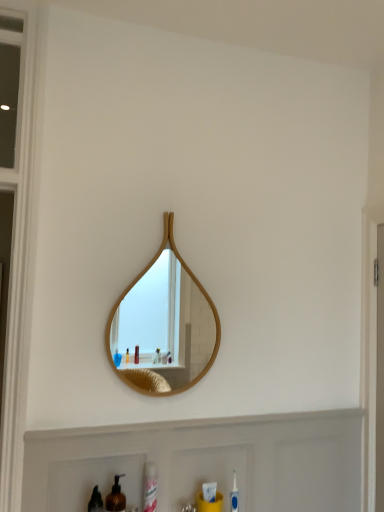
Locate an element on the screen. The image size is (384, 512). brown matte bottle at lower left is located at coordinates (116, 497).

From a real-world perspective, is brown matte bottle at lower left located higher than white matte cabinet at lower center?

No, from a real-world perspective, brown matte bottle at lower left is not on top of white matte cabinet at lower center.

Do you think brown matte bottle at lower left is within white matte cabinet at lower center, or outside of it?

brown matte bottle at lower left is not enclosed by white matte cabinet at lower center.

Considering the points (108, 509) and (191, 484), which point is behind, point (108, 509) or point (191, 484)?

Positioned behind is point (191, 484).

From the picture: From a real-world perspective, is brown matte bottle at lower left beneath white glossy spray can at lower center?

Indeed, from a real-world perspective, brown matte bottle at lower left is positioned beneath white glossy spray can at lower center.

Is brown matte bottle at lower left to the right of white glossy spray can at lower center from the viewer's perspective?

No.

The width and height of the screenshot is (384, 512). In order to click on mouthwash located underneath the white glossy spray can at lower center (from a real-world perspective) in this screenshot , I will do `click(116, 497)`.

Which is behind, brown matte bottle at lower left or white glossy spray can at lower center?

white glossy spray can at lower center is further away from the camera.

Which is closer, (314,426) or (121,372)?

Point (314,426) is positioned closer to the camera compared to point (121,372).

Does white matte cabinet at lower center appear on the right side of wooden mirror at center?

Yes.

Would you say white matte cabinet at lower center is outside wooden mirror at center?

Yes, white matte cabinet at lower center is outside of wooden mirror at center.

From a real-world perspective, between white glossy spray can at lower center and white matte cabinet at lower center, who is vertically lower?

From a 3D spatial view, white glossy spray can at lower center is below.

Is white matte cabinet at lower center inside white glossy spray can at lower center?

No, white matte cabinet at lower center is not a part of white glossy spray can at lower center.

Does white glossy spray can at lower center touch white matte cabinet at lower center?

They are not placed beside each other.

Which point is more forward, (150, 508) or (141, 433)?

Point (150, 508)

Considering the positions of points (125, 302) and (111, 502), is point (125, 302) closer to camera compared to point (111, 502)?

No, it is behind (111, 502).

Considering the sizes of objects wooden mirror at center and brown matte bottle at lower left in the image provided, who is smaller, wooden mirror at center or brown matte bottle at lower left?

With smaller size is brown matte bottle at lower left.

Which of these two, wooden mirror at center or brown matte bottle at lower left, stands taller?

wooden mirror at center.

From the image's perspective, is wooden mirror at center under brown matte bottle at lower left?

No, from the image's perspective, wooden mirror at center is not below brown matte bottle at lower left.

Where is `cleaning product located in front of the wooden mirror at center`? This screenshot has width=384, height=512. cleaning product located in front of the wooden mirror at center is located at coordinates (150, 487).

Is wooden mirror at center spatially inside white glossy spray can at lower center, or outside of it?

wooden mirror at center cannot be found inside white glossy spray can at lower center.

From the picture: Can you tell me how much wooden mirror at center and white glossy spray can at lower center differ in facing direction?

wooden mirror at center and white glossy spray can at lower center are facing 0.403 degrees away from each other.

How far apart are wooden mirror at center and white glossy spray can at lower center?

2.87 meters.

Locate an element on the screen. This screenshot has height=512, width=384. cleaning product lying on the left of white matte cabinet at lower center is located at coordinates (150, 487).

In terms of width, does white matte cabinet at lower center look wider or thinner when compared to white glossy spray can at lower center?

In the image, white matte cabinet at lower center appears to be wider than white glossy spray can at lower center.

Is white matte cabinet at lower center facing towards white glossy spray can at lower center?

Yes, white matte cabinet at lower center is oriented towards white glossy spray can at lower center.

At what (x,y) coordinates should I click in order to perform the action: click on mouthwash in front of the white matte cabinet at lower center. Please return your answer as a coordinate pair (x, y). The image size is (384, 512). Looking at the image, I should click on (x=116, y=497).

The height and width of the screenshot is (512, 384). In order to click on cleaning product that appears above the brown matte bottle at lower left (from a real-world perspective) in this screenshot , I will do `click(150, 487)`.

Based on their spatial positions, is wooden mirror at center or white matte cabinet at lower center closer to white glossy spray can at lower center?

white matte cabinet at lower center is closer to white glossy spray can at lower center.

Estimate the real-world distances between objects in this image. Which object is further from wooden mirror at center, white matte cabinet at lower center or brown matte bottle at lower left?

brown matte bottle at lower left lies further to wooden mirror at center than the other object.

When comparing their distances from wooden mirror at center, does white glossy spray can at lower center or brown matte bottle at lower left seem further?

brown matte bottle at lower left is further to wooden mirror at center.

Estimate the real-world distances between objects in this image. Which object is further from wooden mirror at center, white glossy spray can at lower center or white matte cabinet at lower center?

white glossy spray can at lower center is positioned further to the anchor wooden mirror at center.

Considering their positions, is wooden mirror at center positioned further to brown matte bottle at lower left than white matte cabinet at lower center?

wooden mirror at center.

When comparing their distances from brown matte bottle at lower left, does wooden mirror at center or white glossy spray can at lower center seem further?

wooden mirror at center.

Based on their spatial positions, is brown matte bottle at lower left or wooden mirror at center closer to white matte cabinet at lower center?

brown matte bottle at lower left lies closer to white matte cabinet at lower center than the other object.

In the scene shown: When comparing their distances from brown matte bottle at lower left, does white glossy spray can at lower center or wooden mirror at center seem closer?

white glossy spray can at lower center is positioned closer to the anchor brown matte bottle at lower left.

Image resolution: width=384 pixels, height=512 pixels. In order to click on cabinet between wooden mirror at center and white glossy spray can at lower center vertically in this screenshot , I will do `click(203, 462)`.

Identify the location of cleaning product between brown matte bottle at lower left and white matte cabinet at lower center from left to right. The image size is (384, 512). (150, 487).

Locate an element on the screen. The width and height of the screenshot is (384, 512). mouthwash that lies between wooden mirror at center and white glossy spray can at lower center from top to bottom is located at coordinates (116, 497).

This screenshot has height=512, width=384. Identify the location of mouthwash between wooden mirror at center and white matte cabinet at lower center vertically. (116, 497).